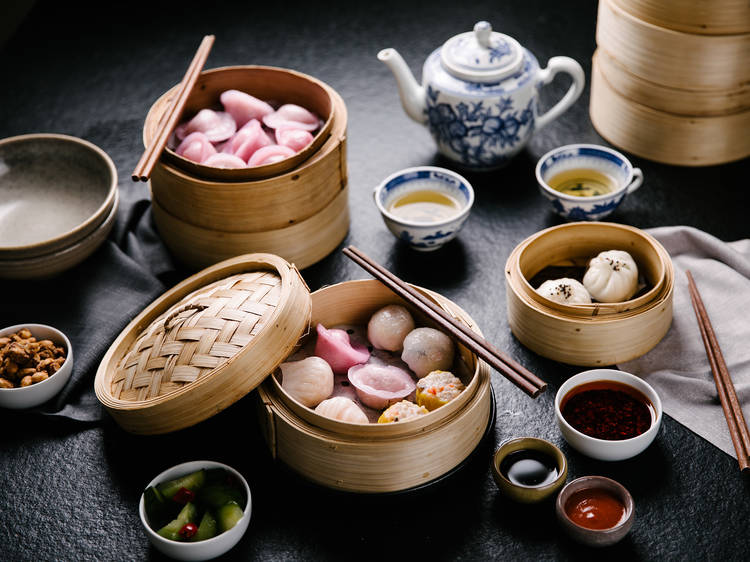
You are a GUI agent. You are given a task and a screenshot of the screen. Output one action in this format:
    pyautogui.click(x=<x>, y=<y>)
    Task: Click on the bowl
    This screenshot has height=562, width=750.
    Given the screenshot: What is the action you would take?
    pyautogui.click(x=90, y=242), pyautogui.click(x=82, y=225), pyautogui.click(x=57, y=382), pyautogui.click(x=222, y=538), pyautogui.click(x=528, y=492), pyautogui.click(x=608, y=531), pyautogui.click(x=620, y=450)